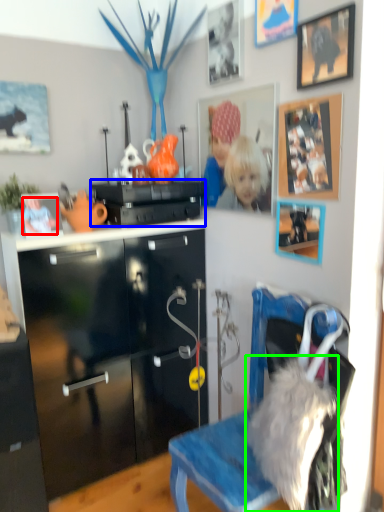
Question: Which object is the farthest from person (highlighted by a red box)? Choose among these: appliance (highlighted by a blue box) or fur (highlighted by a green box).

Choices:
 (A) appliance
 (B) fur

Answer: (B)